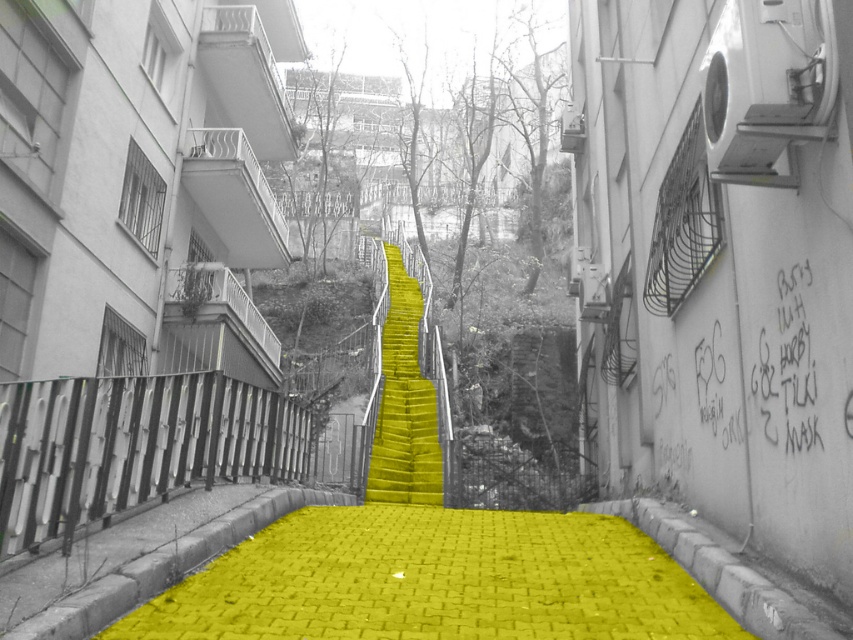
Question: Which object appears farthest from the camera in this image?

Choices:
 (A) yellow matte stairs at center
 (B) yellow brick path at center

Answer: (A)

Question: Does yellow brick path at center appear over yellow matte stairs at center?

Choices:
 (A) no
 (B) yes

Answer: (A)

Question: Which of the following is the closest to the observer?

Choices:
 (A) (424, 477)
 (B) (393, 593)

Answer: (B)

Question: Considering the relative positions of yellow brick path at center and yellow matte stairs at center in the image provided, where is yellow brick path at center located with respect to yellow matte stairs at center?

Choices:
 (A) above
 (B) below

Answer: (B)

Question: Is yellow brick path at center to the left of yellow matte stairs at center from the viewer's perspective?

Choices:
 (A) no
 (B) yes

Answer: (A)